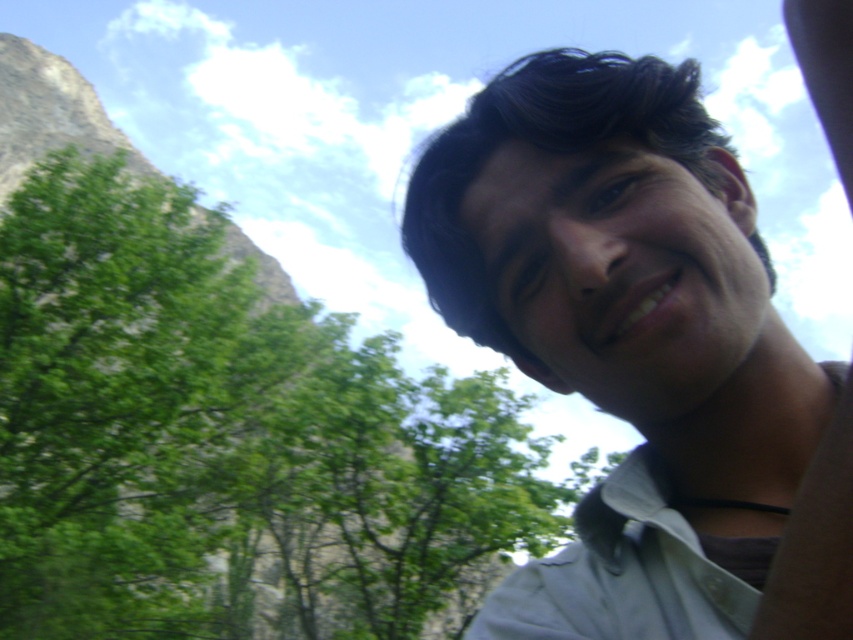
Question: Which of the following is the closest to the observer?

Choices:
 (A) (672, 625)
 (B) (112, 438)

Answer: (A)

Question: Is green leafy tree at upper left bigger than white cotton shirt at lower right?

Choices:
 (A) yes
 (B) no

Answer: (A)

Question: Observing the image, what is the correct spatial positioning of green leafy tree at upper left in reference to white cotton shirt at lower right?

Choices:
 (A) right
 (B) left

Answer: (B)

Question: Among these points, which one is nearest to the camera?

Choices:
 (A) (579, 564)
 (B) (618, 547)
 (C) (128, 474)

Answer: (B)

Question: Does green leafy tree at upper left appear on the right side of white matte shirt at upper right?

Choices:
 (A) no
 (B) yes

Answer: (A)

Question: Which is farther from the white matte shirt at upper right?

Choices:
 (A) white cotton shirt at lower right
 (B) green leafy tree at upper left

Answer: (B)